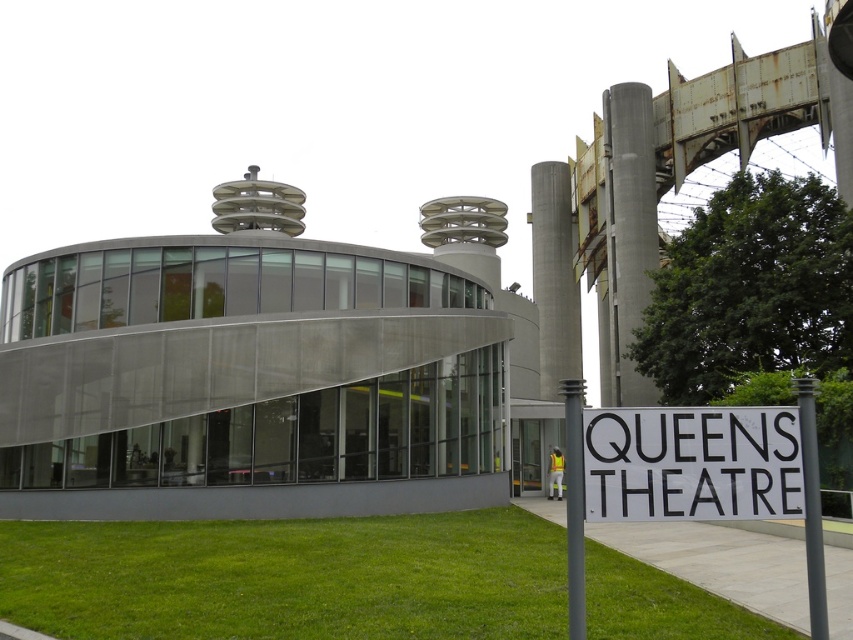
In the scene shown: You are a construction worker assessing the site for a new project. You notice two concrete structures labeled as concrete at right and concrete at center. Which one is taller?

The concrete at center is taller than the concrete at right.

You are standing in front of the Queens Theatre and want to walk towards the concrete at center. Which direction should you head relative to the green grass at lower center?

You should head to the right of the green grass at lower center to reach the concrete at center since the green grass at lower center is to the left of concrete at center.